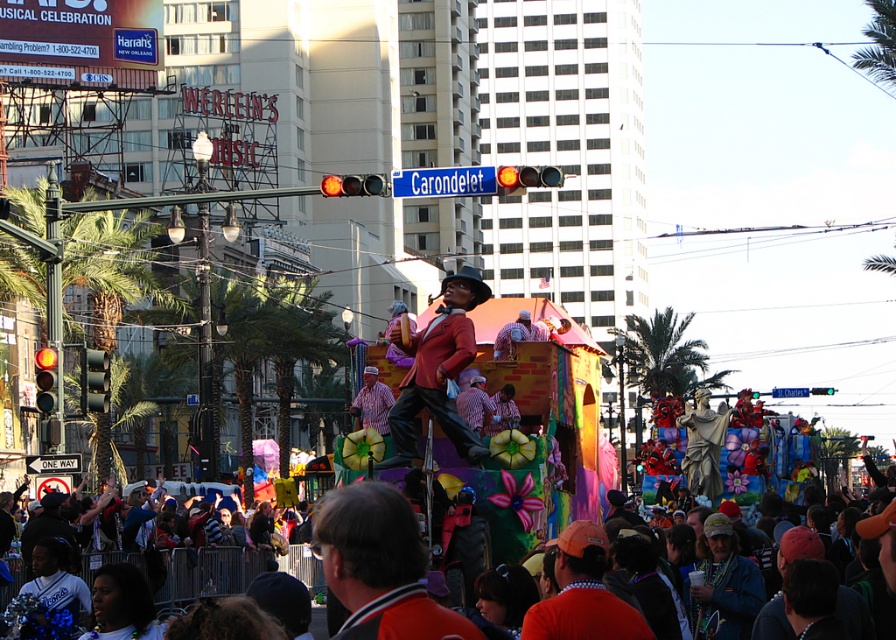
Question: Among these points, which one is farthest from the camera?

Choices:
 (A) (398, 545)
 (B) (530, 618)
 (C) (405, 419)

Answer: (C)

Question: Which point is farther to the camera?

Choices:
 (A) (528, 620)
 (B) (410, 516)

Answer: (A)

Question: In this image, where is matte red suit at center located relative to orange fabric at center?

Choices:
 (A) left
 (B) right

Answer: (A)

Question: Can you confirm if matte red suit at center is positioned below orange fabric at center?

Choices:
 (A) yes
 (B) no

Answer: (B)

Question: Does orange jersey at center lie in front of orange fabric at center?

Choices:
 (A) yes
 (B) no

Answer: (A)

Question: Which point is closer to the camera?

Choices:
 (A) (378, 500)
 (B) (576, 579)

Answer: (A)